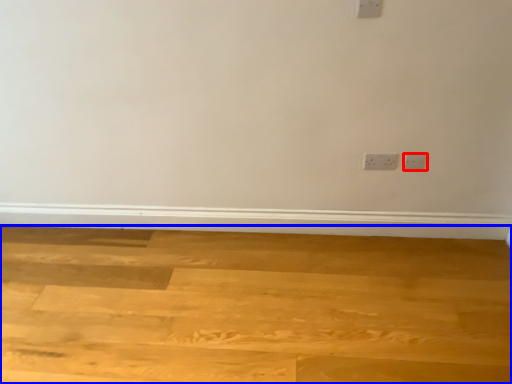
Question: Among these objects, which one is nearest to the camera, power plugs and sockets (highlighted by a red box) or plywood (highlighted by a blue box)?

Choices:
 (A) power plugs and sockets
 (B) plywood

Answer: (B)